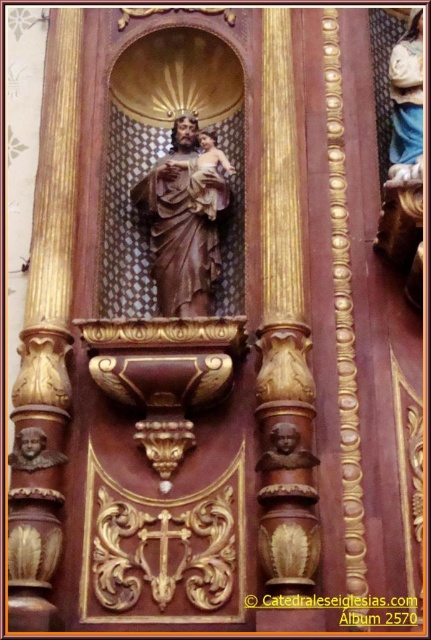
This screenshot has height=640, width=431. What do you see at coordinates (184, 218) in the screenshot? I see `brown polished wood statue at center` at bounding box center [184, 218].

Does brown polished wood statue at center have a smaller size compared to brown wood bust at center?

Actually, brown polished wood statue at center might be larger than brown wood bust at center.

Who is more distant from viewer, (180, 266) or (300, 465)?

The point (180, 266) is more distant.

At what (x,y) coordinates should I click in order to perform the action: click on brown polished wood statue at center. Please return your answer as a coordinate pair (x, y). The image size is (431, 640). Looking at the image, I should click on (184, 218).

Who is more forward, (271,449) or (31,435)?

Point (271,449) is in front.

Is brown wood bust at center positioned in front of matte brown bust at lower left?

Yes, it is.

Where is `brown wood bust at center`? Image resolution: width=431 pixels, height=640 pixels. brown wood bust at center is located at coordinates (284, 451).

Who is positioned more to the left, brown polished wood statue at center or matte brown bust at lower left?

From the viewer's perspective, matte brown bust at lower left appears more on the left side.

Is brown polished wood statue at center to the left of matte brown bust at lower left from the viewer's perspective?

Incorrect, brown polished wood statue at center is not on the left side of matte brown bust at lower left.

The height and width of the screenshot is (640, 431). In order to click on brown polished wood statue at center in this screenshot , I will do 184,218.